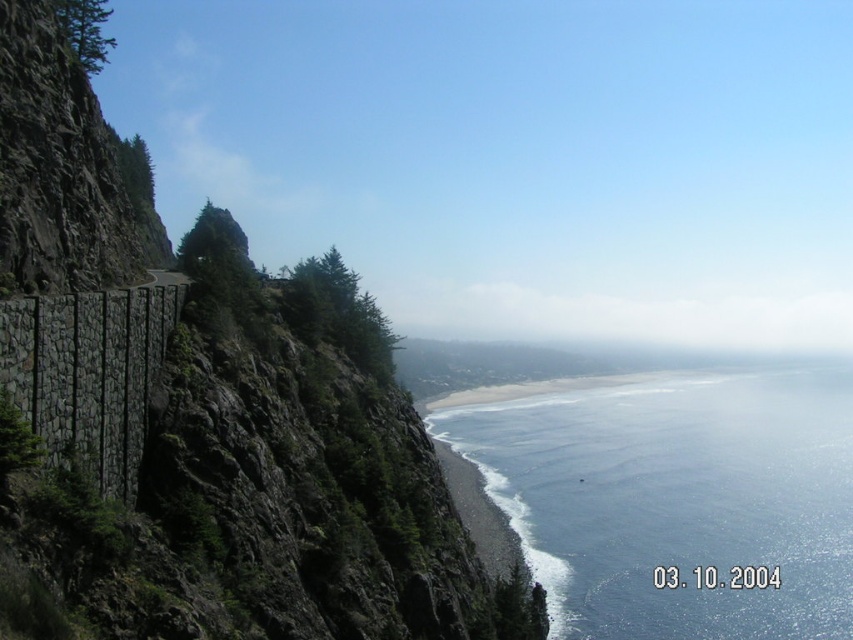
You are a hiker standing at the cliff edge. You see the rocky cliff at left and the blue liquid water at lower center. Which object is positioned to the left of the other?

The rocky cliff at left is to the left of blue liquid water at lower center.

You are a hiker standing on the rocky cliff at left. You want to reach the blue liquid water at lower center. Is there a direct path downwards from your current position to the water?

The rocky cliff at left is above blue liquid water at lower center, so there is a direct path downwards from the rocky cliff at left to the blue liquid water at lower center.

You are a hiker standing on the rocky cliff at left and want to reach the blue liquid water at lower center. Given that the distance between them is 79.96 meters, can you safely walk directly down the cliff to reach the water? Explain your reasoning based on the scene description.

The rocky cliff at left and blue liquid water at lower center are 79.96 meters apart. However, the scene describes the cliff as steep and rugged with sparse vegetation, making it unsafe to walk directly down. The stone retaining wall and road suggest a safer designated path exists. Therefore, it is not advisable to attempt a direct descent.